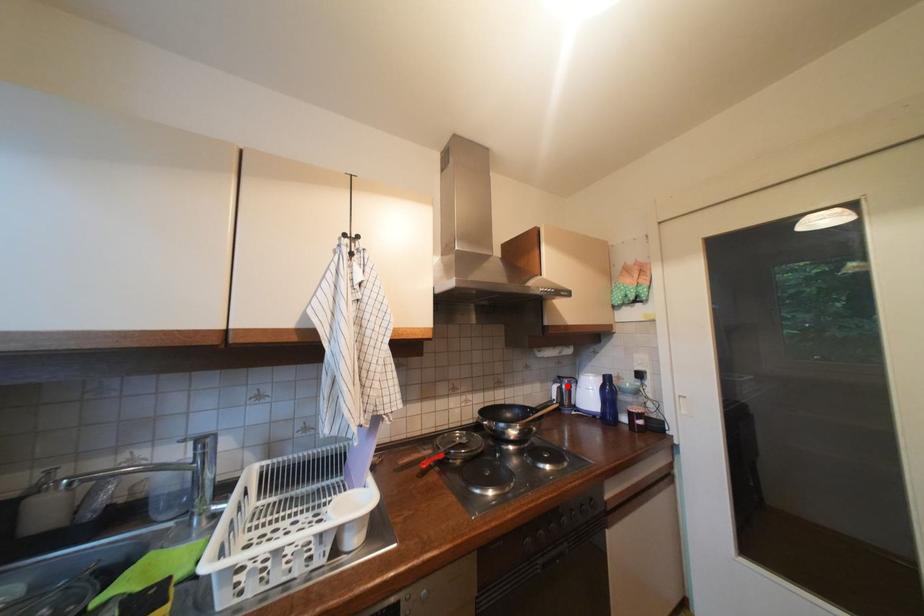
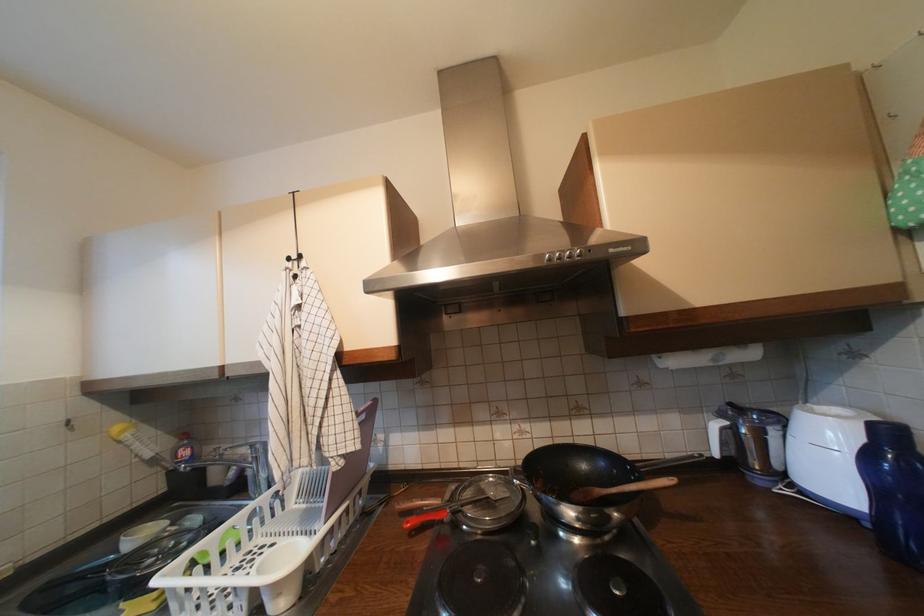
Question: I am providing you with two images of the same scene from different viewpoints. Image1 has a red point marked. In image2, the corresponding 3D location appears at what relative position? Reply with the corresponding letter.

Choices:
 (A) Closer
 (B) Farther

Answer: (A)